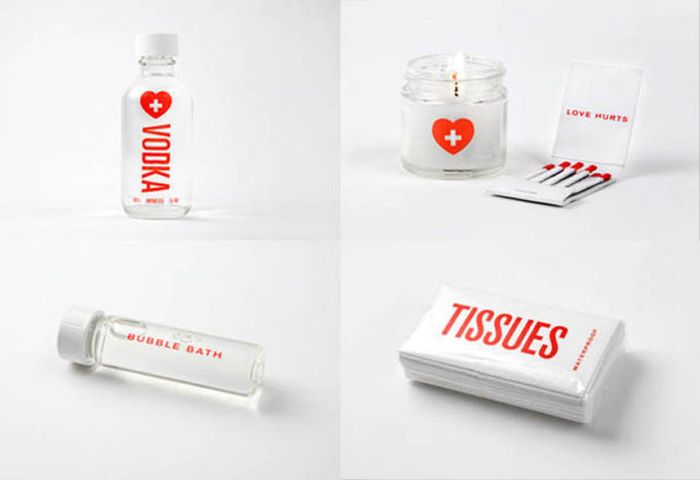
Locate an element on the screen. This screenshot has height=480, width=700. bottle is located at coordinates (168, 132).